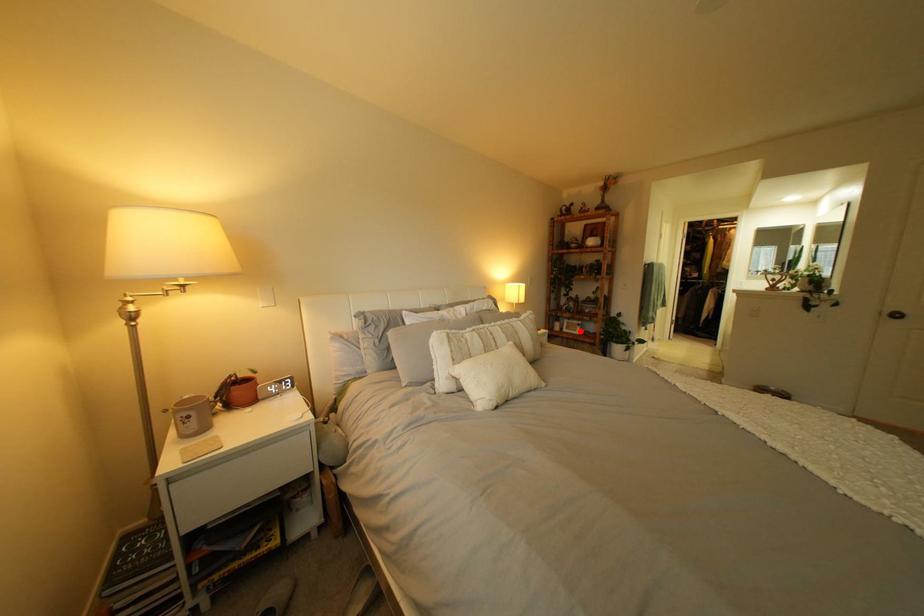
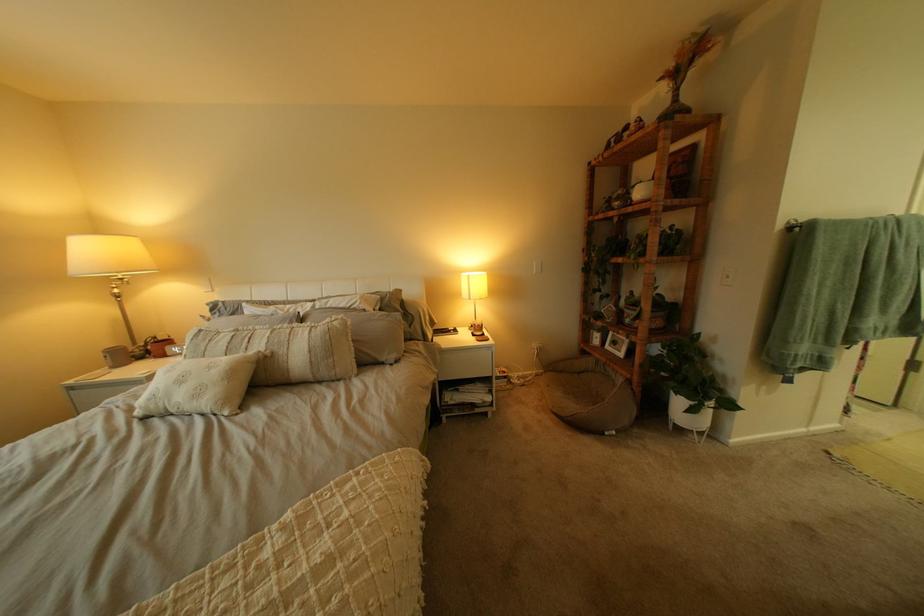
Question: I am providing you with two images of the same scene from different viewpoints. Image1 has a red point marked. In image2, the corresponding 3D location appears at what relative position? Reply with the corresponding letter.

Choices:
 (A) Closer
 (B) Farther

Answer: (A)